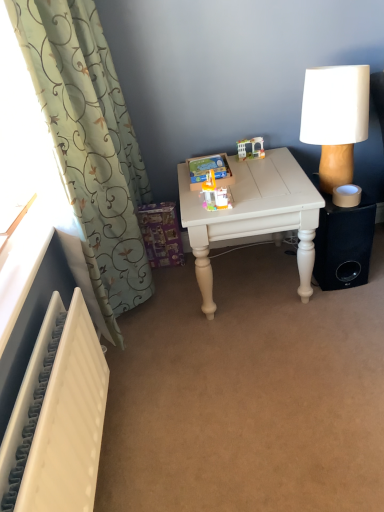
Question: From the image's perspective, is black matte speaker at lower right on top of translucent plastic toy at center, positioned as the second toy in top-to-bottom order?

Choices:
 (A) no
 (B) yes

Answer: (A)

Question: Is black matte speaker at lower right completely or partially outside of translucent plastic toy at center, positioned as the second toy in top-to-bottom order?

Choices:
 (A) yes
 (B) no

Answer: (A)

Question: Does black matte speaker at lower right lie behind translucent plastic toy at center, the 1th toy in the front-to-back sequence?

Choices:
 (A) yes
 (B) no

Answer: (A)

Question: Considering the relative positions of black matte speaker at lower right and translucent plastic toy at center, the second toy in the right-to-left sequence, in the image provided, is black matte speaker at lower right in front of translucent plastic toy at center, the second toy in the right-to-left sequence,?

Choices:
 (A) no
 (B) yes

Answer: (A)

Question: From the image's perspective, would you say black matte speaker at lower right is shown under translucent plastic toy at center, the 1th toy in the front-to-back sequence?

Choices:
 (A) yes
 (B) no

Answer: (A)

Question: Considering the positions of white textured radiator at lower left and translucent plastic toy at center, the second toy in the right-to-left sequence, in the image, is white textured radiator at lower left wider or thinner than translucent plastic toy at center, the second toy in the right-to-left sequence,?

Choices:
 (A) wide
 (B) thin

Answer: (B)

Question: Would you say white textured radiator at lower left is inside or outside translucent plastic toy at center, the 1th toy in the front-to-back sequence?

Choices:
 (A) outside
 (B) inside

Answer: (A)

Question: In terms of height, does white textured radiator at lower left look taller or shorter compared to translucent plastic toy at center, the second toy in the right-to-left sequence?

Choices:
 (A) tall
 (B) short

Answer: (A)

Question: From a real-world perspective, is white textured radiator at lower left physically located above or below translucent plastic toy at center, the second toy in the right-to-left sequence?

Choices:
 (A) above
 (B) below

Answer: (B)

Question: From a real-world perspective, is translucent plastic toy house at upper center, the second toy viewed from the front, above or below translucent plastic toy at center, the first toy from the bottom?

Choices:
 (A) above
 (B) below

Answer: (B)

Question: Is point (258, 137) closer or farther from the camera than point (223, 194)?

Choices:
 (A) closer
 (B) farther

Answer: (B)

Question: Is translucent plastic toy house at upper center, which is the 2th toy from left to right, inside the boundaries of translucent plastic toy at center, the 1th toy in the front-to-back sequence, or outside?

Choices:
 (A) outside
 (B) inside

Answer: (A)

Question: Considering the positions of translucent plastic toy house at upper center, which is the first toy in right-to-left order, and translucent plastic toy at center, positioned as the second toy in top-to-bottom order, in the image, is translucent plastic toy house at upper center, which is the first toy in right-to-left order, taller or shorter than translucent plastic toy at center, positioned as the second toy in top-to-bottom order,?

Choices:
 (A) short
 (B) tall

Answer: (A)

Question: Is point (251, 147) positioned closer to the camera than point (332, 82)?

Choices:
 (A) closer
 (B) farther

Answer: (B)

Question: From their relative heights in the image, would you say translucent plastic toy house at upper center, the 1th toy in the top-to-bottom sequence, is taller or shorter than white fabric-covered lamp at right?

Choices:
 (A) tall
 (B) short

Answer: (B)